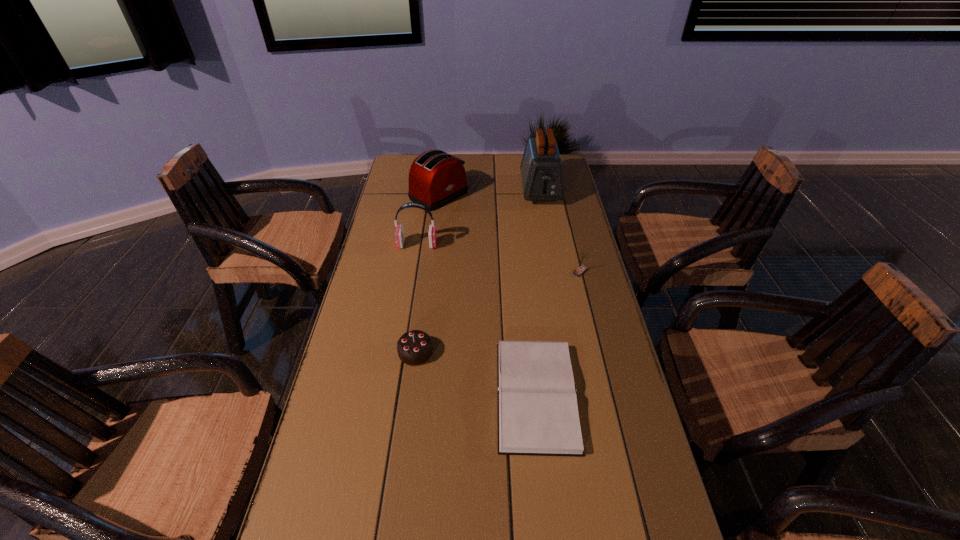
Image resolution: width=960 pixels, height=540 pixels. I want to click on free location that satisfies the following two spatial constraints: 1. on the back side of the fourth tallest object; 2. on the right side of the hardback book, so click(x=523, y=272).

At what (x,y) coordinates should I click in order to perform the action: click on vacant position in the image that satisfies the following two spatial constraints: 1. on the front side of the shortest object; 2. on the left side of the second shortest object. Please return your answer as a coordinate pair (x, y). The height and width of the screenshot is (540, 960). Looking at the image, I should click on (410, 395).

Where is `vacant space that satisfies the following two spatial constraints: 1. on the front-facing side of the right toaster; 2. on the right side of the matchbox`? vacant space that satisfies the following two spatial constraints: 1. on the front-facing side of the right toaster; 2. on the right side of the matchbox is located at coordinates (555, 272).

This screenshot has width=960, height=540. Find the location of `vacant space that satisfies the following two spatial constraints: 1. on the front side of the left toaster; 2. on the outer surface of the earphone`. vacant space that satisfies the following two spatial constraints: 1. on the front side of the left toaster; 2. on the outer surface of the earphone is located at coordinates (433, 245).

This screenshot has height=540, width=960. I want to click on vacant space that satisfies the following two spatial constraints: 1. on the back side of the shorter toaster; 2. on the right side of the second shortest object, so click(437, 195).

I want to click on free space that satisfies the following two spatial constraints: 1. on the outer surface of the earphone; 2. on the back side of the fourth tallest object, so click(413, 272).